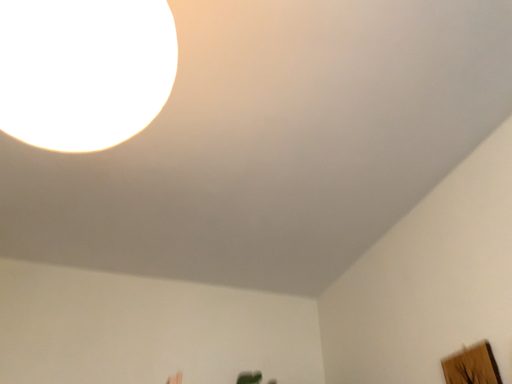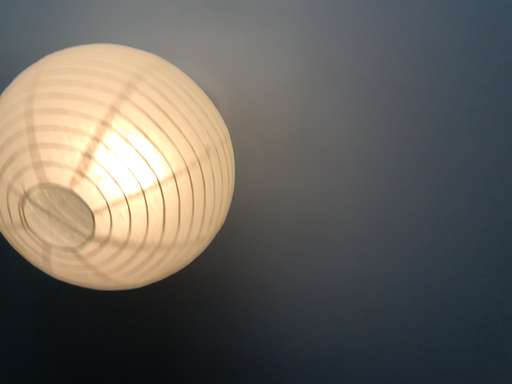
Question: Which way did the camera rotate in the video?

Choices:
 (A) rotated left
 (B) rotated right

Answer: (A)